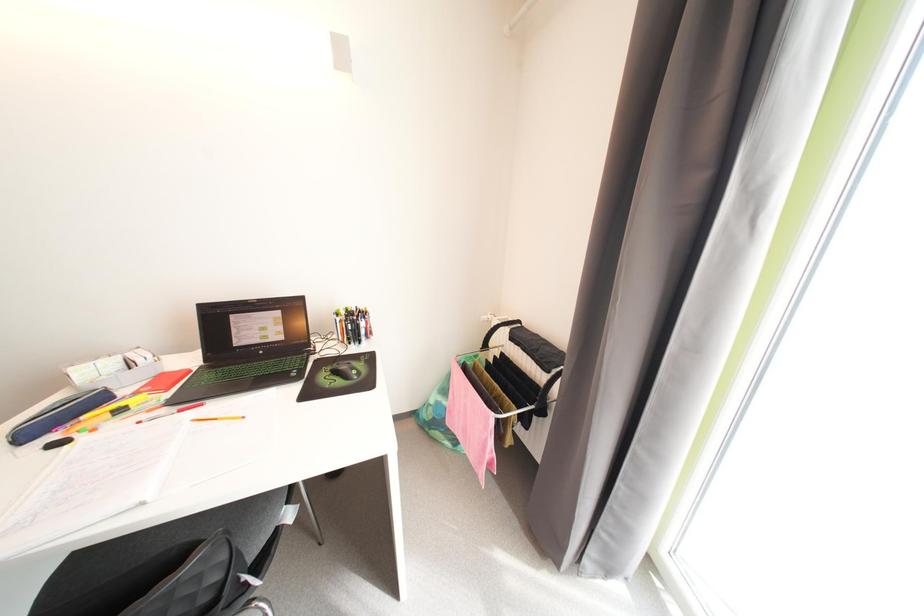
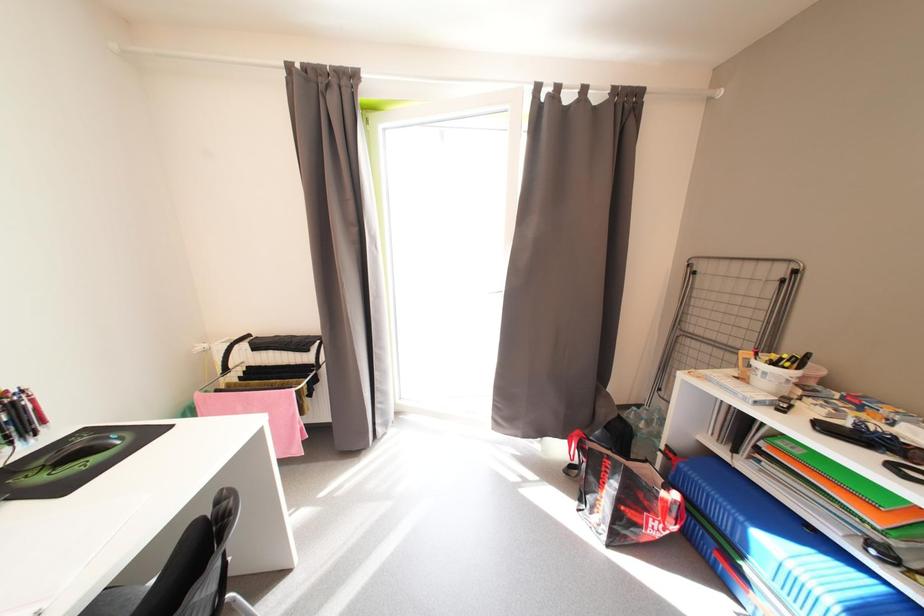
Question: The images are taken continuously from a first-person perspective. In which direction is your viewpoint rotating?

Choices:
 (A) Left
 (B) Right
 (C) Up
 (D) Down

Answer: (B)